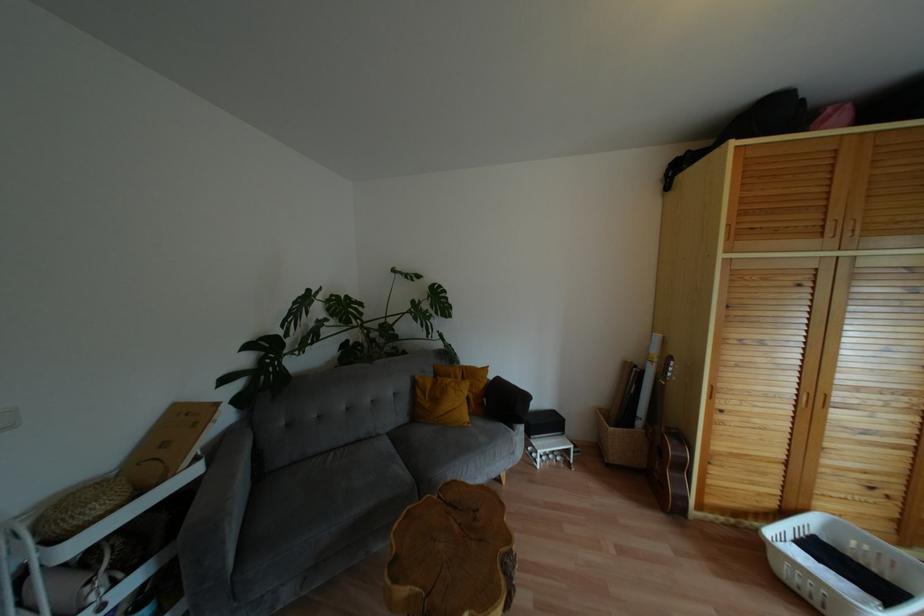
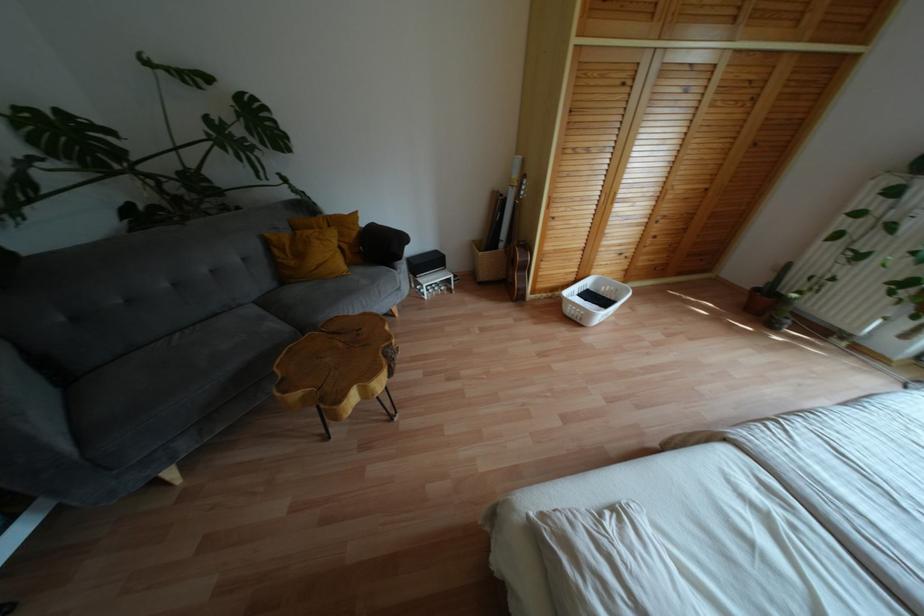
Where in the second image is the point corresponding to [365,438] from the first image?

(224, 312)